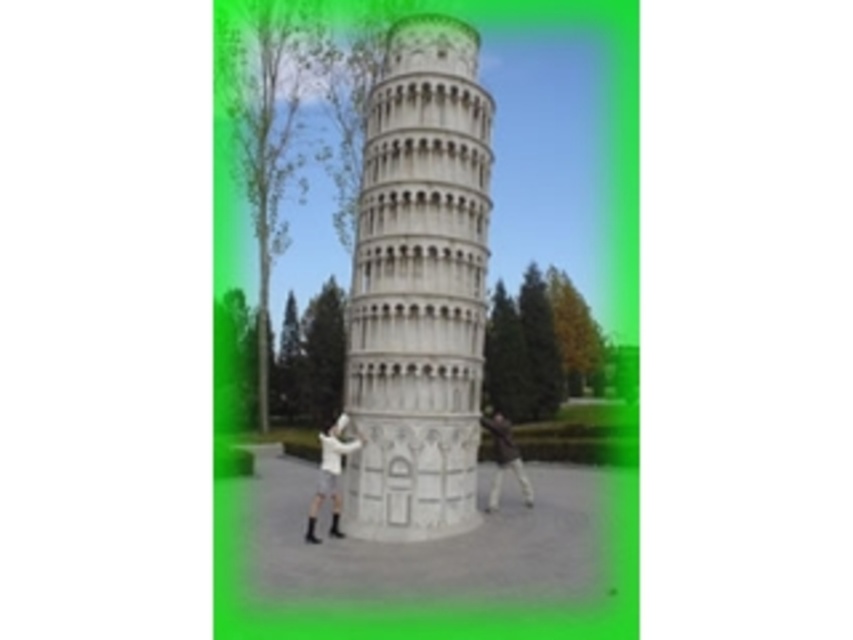
Where is the white stone tower at center located in the image?

The white stone tower at center is located at point coordinates of 0.452 on the x axis and 0.492 on the y axis.

You are standing in front of the leaning tower and want to place a small flag at the closest point to you between point (457, 72) and point (335, 524). Which point should you choose?

Point (335, 524) is closer to you than point (457, 72), so you should choose point (335, 524) to place the flag.